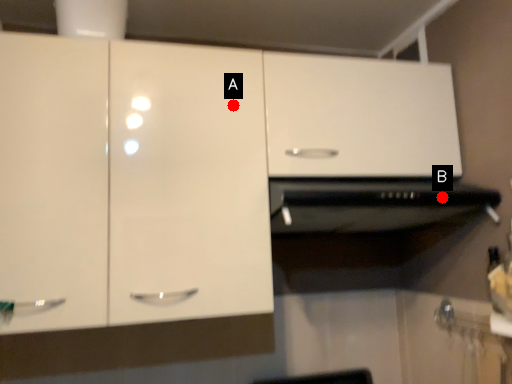
Question: Two points are circled on the image, labeled by A and B beside each circle. Which point is closer to the camera?

Choices:
 (A) A is closer
 (B) B is closer

Answer: (A)